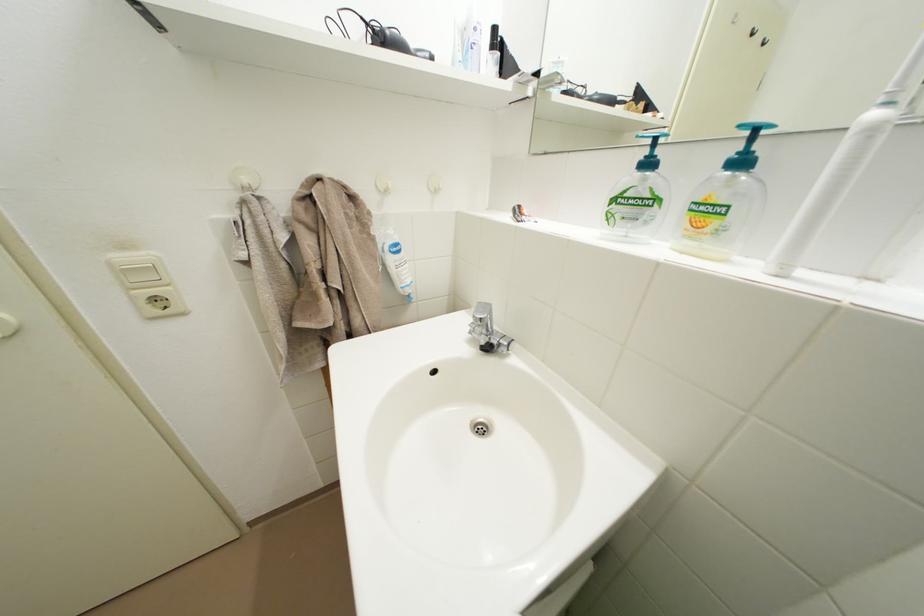
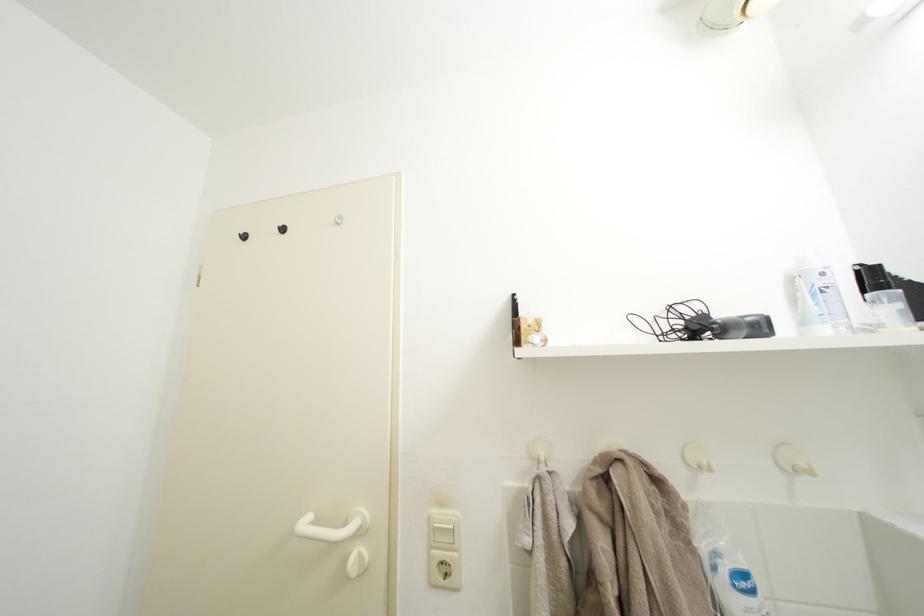
Locate, in the second image, the point that corresponds to point 506,74 in the first image.

(910, 310)